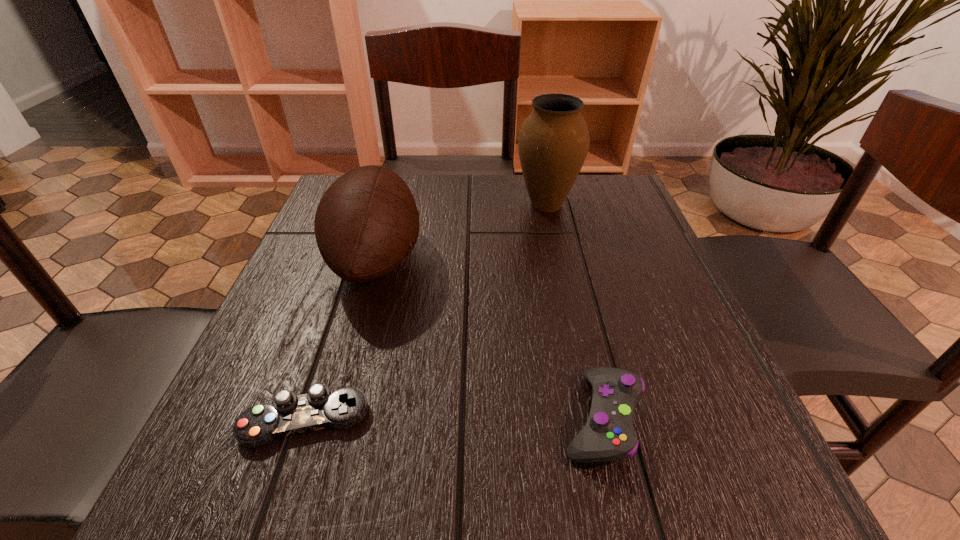
This screenshot has width=960, height=540. I want to click on vacant space at the far edge, so click(x=439, y=205).

At what (x,y) coordinates should I click in order to perform the action: click on free point at the near edge. Please return your answer as a coordinate pair (x, y). The image size is (960, 540). Looking at the image, I should click on (491, 486).

Identify the location of free space at the right edge of the desktop. This screenshot has height=540, width=960. pos(625,347).

I want to click on blank space at the near left corner of the desktop, so click(x=281, y=489).

You are a GUI agent. You are given a task and a screenshot of the screen. Output one action in this format:
    pyautogui.click(x=<x>, y=<y>)
    Task: Click on the vacant space at the far right corner of the desktop
    
    Given the screenshot: What is the action you would take?
    pyautogui.click(x=569, y=205)

This screenshot has height=540, width=960. Find the location of `free spot at the near right corner of the desktop`. free spot at the near right corner of the desktop is located at coordinates (666, 443).

Locate an element on the screen. free spot between the second shortest object and the tallest object is located at coordinates (574, 311).

Where is `vacant area that lies between the taller control and the tallest object`? vacant area that lies between the taller control and the tallest object is located at coordinates (574, 311).

You are a GUI agent. You are given a task and a screenshot of the screen. Output one action in this format:
    pyautogui.click(x=<x>, y=<y>)
    Task: Click on the free spot between the tallest object and the second tallest object
    
    Given the screenshot: What is the action you would take?
    pyautogui.click(x=462, y=232)

This screenshot has width=960, height=540. I want to click on free space between the urn and the shorter control, so click(426, 313).